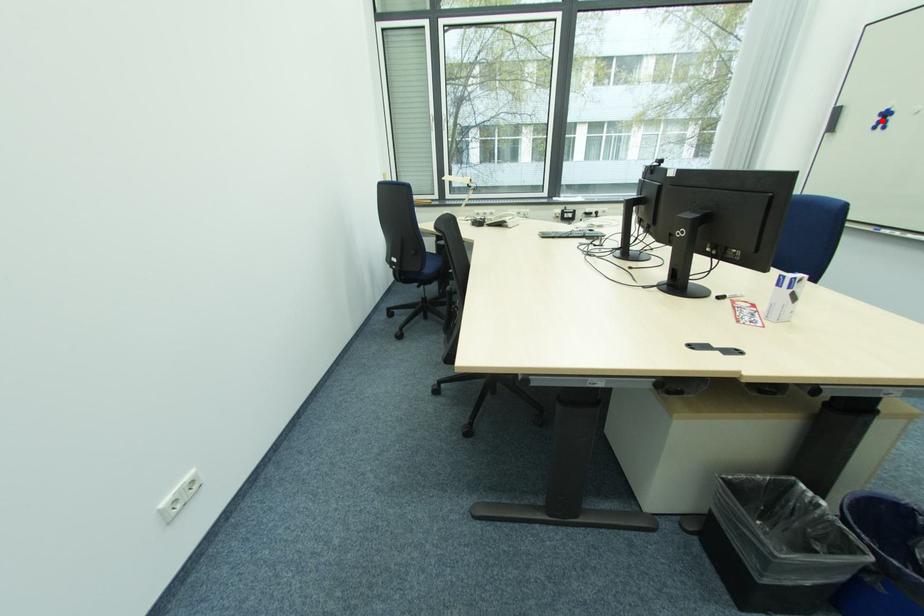
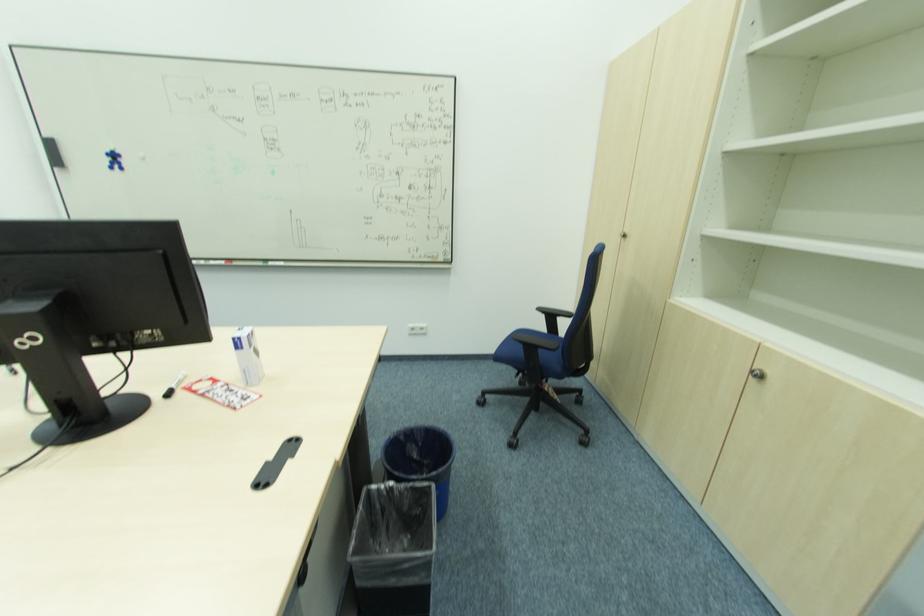
Locate, in the second image, the point that corresponds to the highlighted location in the first image.

(116, 161)